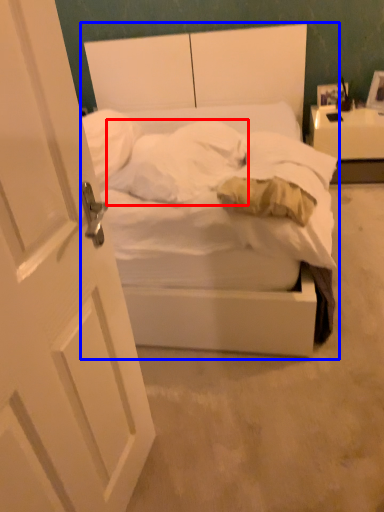
Question: Which object is further to the camera taking this photo, pillow (highlighted by a red box) or bed (highlighted by a blue box)?

Choices:
 (A) pillow
 (B) bed

Answer: (A)